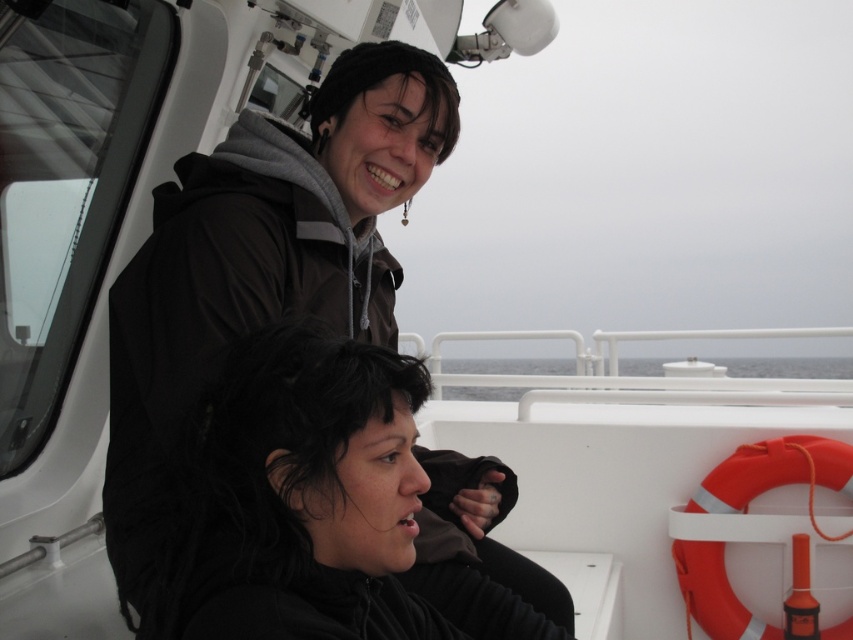
From the picture: You are a photographer trying to capture a closeup of the black matte hair at center and the gray water at center. Which object would you need to zoom in more on to fill the frame, considering their sizes?

The black matte hair at center is thinner than the gray water at center, so you would need to zoom in more on the black matte hair at center to fill the frame since it is smaller.

You are standing on the deck of a boat and want to place a new navigation tool at a specific point that is exactly 3.88 feet away from where you are currently standing. The boat has a white deck with a bright orange lifebuoy on the right side of the railing. There are two people seated here, one in a dark jacket and another in a brown jacket. Can you confirm if the point you want to place the navigation tool at corresponds to the location of the point marked at coordinates point (309, 401)?

Yes, the point marked at coordinates point (309, 401) is exactly 3.88 feet away from the camera, so placing the navigation tool there would meet the requirement.

Based on the photo, you are a photographer on a boat deck. You need to place a small camera bag between the orange rubber life jacket at right and the gray water at center. Can you fit it there?

The orange rubber life jacket at right is thinner than the gray water at center, so the space between them is sufficient to place the small camera bag there.